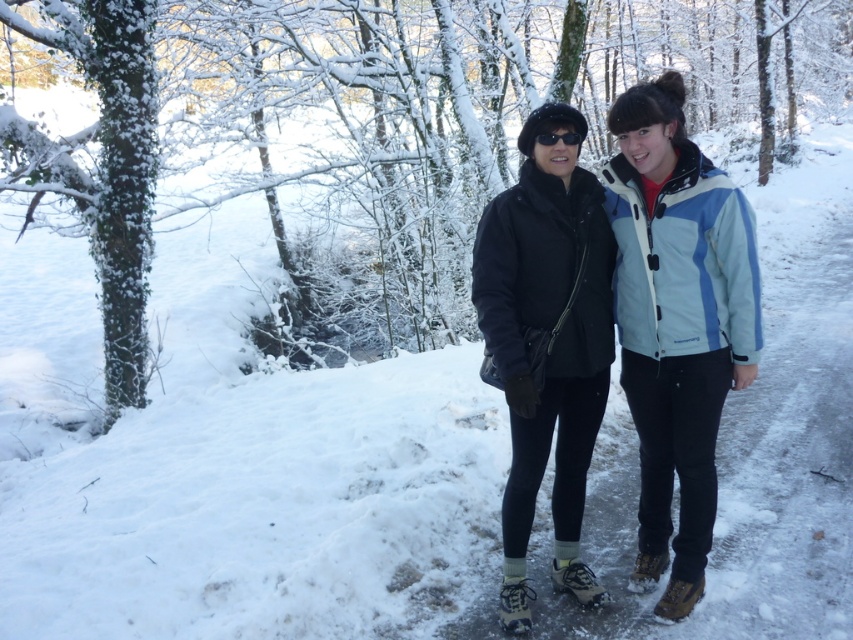
You are standing in a snowy winter scene with two points marked on the ground. The first point is at coordinates point (x=550, y=577) and the second is at point (x=634, y=563). Which point is closer to you?

Point (x=550, y=577) is closer to the camera than point (x=634, y=563), so the first point is closer to you.

You are planning to take a winter hike and need to decide which item to carry first. The matte blue jacket at center and the white textured snowshoe at lower center are both essential. Based on their sizes, which item should you pick up first if you want to carry the larger one first?

The matte blue jacket at center has a larger width than the white textured snowshoe at lower center, so you should pick up the matte blue jacket at center first.

You are planning to take a winter hike and need to decide which item to pack first between the black matte jacket at center and the brown leather snowshoe at lower right. Based on their sizes, which one requires more storage space in your backpack?

The black matte jacket at center has a greater height compared to the brown leather snowshoe at lower right, so it requires more storage space in your backpack.